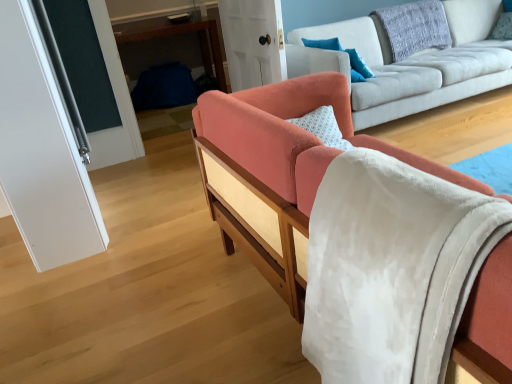
What do you see at coordinates (346, 52) in the screenshot? I see `blue textured pillow at upper center, which is counted as the 1th pillow, starting from the left` at bounding box center [346, 52].

Locate an element on the screen. blue textured pillow at upper center, marked as the 3th pillow in a right-to-left arrangement is located at coordinates (346, 52).

Locate an element on the screen. This screenshot has width=512, height=384. textured gray pillow at upper right, the second pillow positioned from the left is located at coordinates (414, 27).

The width and height of the screenshot is (512, 384). What are the coordinates of `coral fabric couch at center, the 1th studio couch when ordered from front to back` in the screenshot? It's located at (280, 171).

Identify the location of blue textured pillow at upper center, marked as the 3th pillow in a right-to-left arrangement. click(346, 52).

Is coral fabric couch at center, which ranks as the 2th studio couch in back-to-front order, taller than light gray fabric couch at center, the second studio couch from the front?

Yes, coral fabric couch at center, which ranks as the 2th studio couch in back-to-front order, is taller than light gray fabric couch at center, the second studio couch from the front.

In terms of width, does coral fabric couch at center, which ranks as the 2th studio couch in back-to-front order, look wider or thinner when compared to light gray fabric couch at center, the second studio couch from the front?

In the image, coral fabric couch at center, which ranks as the 2th studio couch in back-to-front order, appears to be more narrow than light gray fabric couch at center, the second studio couch from the front.

Where is `studio couch below the light gray fabric couch at center, the second studio couch from the front (from the image's perspective)`? This screenshot has width=512, height=384. studio couch below the light gray fabric couch at center, the second studio couch from the front (from the image's perspective) is located at coordinates (280, 171).

Does coral fabric couch at center, the 1th studio couch when ordered from front to back, turn towards light gray fabric couch at center, the second studio couch from the front?

Yes, coral fabric couch at center, the 1th studio couch when ordered from front to back, faces towards light gray fabric couch at center, the second studio couch from the front.

Considering the relative sizes of textured gray pillow at upper right, the second pillow positioned from the left, and blue fabric table at center in the image provided, is textured gray pillow at upper right, the second pillow positioned from the left, shorter than blue fabric table at center?

Indeed, textured gray pillow at upper right, the second pillow positioned from the left, has a lesser height compared to blue fabric table at center.

At what (x,y) coordinates should I click in order to perform the action: click on table above the textured gray pillow at upper right, which appears as the second pillow when viewed from the right (from the image's perspective). Please return your answer as a coordinate pair (x, y). Looking at the image, I should click on (170, 46).

Which object is positioned more to the right, textured gray pillow at upper right, which appears as the second pillow when viewed from the right, or blue fabric table at center?

From the viewer's perspective, textured gray pillow at upper right, which appears as the second pillow when viewed from the right, appears more on the right side.

Can you tell me how much blue textured pillow at upper right, the first pillow when ordered from right to left, and transparent glass door at upper center, the first glass door from the right, differ in facing direction?

blue textured pillow at upper right, the first pillow when ordered from right to left, and transparent glass door at upper center, the first glass door from the right, are facing 26.1 degrees away from each other.

Considering the positions of objects blue textured pillow at upper right, the first pillow when ordered from right to left, and transparent glass door at upper center, arranged as the second glass door when viewed from the left, in the image provided, who is behind, blue textured pillow at upper right, the first pillow when ordered from right to left, or transparent glass door at upper center, arranged as the second glass door when viewed from the left,?

blue textured pillow at upper right, the first pillow when ordered from right to left, is further away from the camera.

Is transparent glass door at upper center, which is the 2th glass door from front to back, located within blue textured pillow at upper right, the first pillow when ordered from right to left?

No, transparent glass door at upper center, which is the 2th glass door from front to back, is not a part of blue textured pillow at upper right, the first pillow when ordered from right to left.

Between coral fabric couch at center, which ranks as the 2th studio couch in back-to-front order, and clear glass door at upper left, the second glass door in the right-to-left sequence, which one is positioned behind?

clear glass door at upper left, the second glass door in the right-to-left sequence, is further away from the camera.

Is coral fabric couch at center, which ranks as the 2th studio couch in back-to-front order, wider or thinner than clear glass door at upper left, placed as the first glass door when sorted from front to back?

In the image, coral fabric couch at center, which ranks as the 2th studio couch in back-to-front order, appears to be wider than clear glass door at upper left, placed as the first glass door when sorted from front to back.

Which is farther, (279, 279) or (56, 2)?

Positioned behind is point (56, 2).

Is coral fabric couch at center, which ranks as the 2th studio couch in back-to-front order, positioned with its back to clear glass door at upper left, the second glass door in the right-to-left sequence?

coral fabric couch at center, which ranks as the 2th studio couch in back-to-front order, does not have its back to clear glass door at upper left, the second glass door in the right-to-left sequence.

How different are the orientations of blue fabric table at center and transparent glass door at upper center, arranged as the second glass door when viewed from the left, in degrees?

The angular difference between blue fabric table at center and transparent glass door at upper center, arranged as the second glass door when viewed from the left, is 99 degrees.

From the image's perspective, is blue fabric table at center above or below transparent glass door at upper center, which is the 2th glass door from front to back?

Clearly, from the image's perspective, blue fabric table at center is above transparent glass door at upper center, which is the 2th glass door from front to back.

Measure the distance from blue fabric table at center to transparent glass door at upper center, arranged as the second glass door when viewed from the left.

5.40 feet.

Considering the sizes of blue fabric table at center and transparent glass door at upper center, which is the 2th glass door from front to back, in the image, is blue fabric table at center bigger or smaller than transparent glass door at upper center, which is the 2th glass door from front to back,?

In the image, blue fabric table at center appears to be larger than transparent glass door at upper center, which is the 2th glass door from front to back.

What's the angular difference between textured gray pillow at upper right, which appears as the second pillow when viewed from the right, and light gray fabric couch at center, the second studio couch from the front,'s facing directions?

The angle between the facing direction of textured gray pillow at upper right, which appears as the second pillow when viewed from the right, and the facing direction of light gray fabric couch at center, the second studio couch from the front, is 0.000285 degrees.

Is textured gray pillow at upper right, which appears as the second pillow when viewed from the right, inside or outside of light gray fabric couch at center, the second studio couch from the front?

textured gray pillow at upper right, which appears as the second pillow when viewed from the right, is spatially positioned inside light gray fabric couch at center, the second studio couch from the front.

Is textured gray pillow at upper right, which appears as the second pillow when viewed from the right, to the left of light gray fabric couch at center, the first studio couch positioned from the back, from the viewer's perspective?

Correct, you'll find textured gray pillow at upper right, which appears as the second pillow when viewed from the right, to the left of light gray fabric couch at center, the first studio couch positioned from the back.

From the image's perspective, is textured gray pillow at upper right, which appears as the second pillow when viewed from the right, beneath light gray fabric couch at center, the first studio couch positioned from the back?

Incorrect, from the image's perspective, textured gray pillow at upper right, which appears as the second pillow when viewed from the right, is higher than light gray fabric couch at center, the first studio couch positioned from the back.

Does coral fabric couch at center, which ranks as the 2th studio couch in back-to-front order, turn towards blue textured pillow at upper center, which is counted as the 1th pillow, starting from the left?

No, coral fabric couch at center, which ranks as the 2th studio couch in back-to-front order, is not aimed at blue textured pillow at upper center, which is counted as the 1th pillow, starting from the left.

Is there a large distance between coral fabric couch at center, the 1th studio couch when ordered from front to back, and blue textured pillow at upper center, marked as the 3th pillow in a right-to-left arrangement?

Yes, coral fabric couch at center, the 1th studio couch when ordered from front to back, is far from blue textured pillow at upper center, marked as the 3th pillow in a right-to-left arrangement.

In the image, is coral fabric couch at center, the 1th studio couch when ordered from front to back, positioned in front of or behind blue textured pillow at upper center, marked as the 3th pillow in a right-to-left arrangement?

coral fabric couch at center, the 1th studio couch when ordered from front to back, is in front of blue textured pillow at upper center, marked as the 3th pillow in a right-to-left arrangement.

Which is in front, point (483, 296) or point (359, 74)?

Positioned in front is point (483, 296).

This screenshot has width=512, height=384. In order to click on studio couch behind the coral fabric couch at center, which ranks as the 2th studio couch in back-to-front order in this screenshot , I will do `click(411, 63)`.

The height and width of the screenshot is (384, 512). Identify the location of table above the textured gray pillow at upper right, which appears as the second pillow when viewed from the right (from the image's perspective). (170, 46).

Which object lies further to the anchor point transparent glass door at upper center, arranged as the second glass door when viewed from the left, textured gray pillow at upper right, which appears as the second pillow when viewed from the right, or blue textured pillow at upper right, the first pillow when ordered from right to left?

blue textured pillow at upper right, the first pillow when ordered from right to left, is further to transparent glass door at upper center, arranged as the second glass door when viewed from the left.

From the image, which object appears to be nearer to light gray fabric couch at center, the second studio couch from the front, clear glass door at upper left, the second glass door in the right-to-left sequence, or coral fabric couch at center, which ranks as the 2th studio couch in back-to-front order?

coral fabric couch at center, which ranks as the 2th studio couch in back-to-front order, is positioned closer to the anchor light gray fabric couch at center, the second studio couch from the front.

Looking at the image, which one is located further to light gray fabric couch at center, the first studio couch positioned from the back, blue textured pillow at upper right, the first pillow when ordered from right to left, or coral fabric couch at center, which ranks as the 2th studio couch in back-to-front order?

coral fabric couch at center, which ranks as the 2th studio couch in back-to-front order, lies further to light gray fabric couch at center, the first studio couch positioned from the back, than the other object.

Estimate the real-world distances between objects in this image. Which object is closer to clear glass door at upper left, acting as the 2th glass door starting from the back, blue textured pillow at upper right, placed as the third pillow when sorted from left to right, or blue textured pillow at upper center, marked as the 3th pillow in a right-to-left arrangement?

Based on the image, blue textured pillow at upper center, marked as the 3th pillow in a right-to-left arrangement, appears to be nearer to clear glass door at upper left, acting as the 2th glass door starting from the back.

Which object lies further to the anchor point blue fabric table at center, coral fabric couch at center, the 1th studio couch when ordered from front to back, or light gray fabric couch at center, the first studio couch positioned from the back?

Among the two, coral fabric couch at center, the 1th studio couch when ordered from front to back, is located further to blue fabric table at center.

Based on the photo, estimate the real-world distances between objects in this image. Which object is closer to blue textured pillow at upper right, placed as the third pillow when sorted from left to right, clear glass door at upper left, the second glass door in the right-to-left sequence, or blue fabric table at center?

blue fabric table at center lies closer to blue textured pillow at upper right, placed as the third pillow when sorted from left to right, than the other object.

Looking at the image, which one is located closer to blue textured pillow at upper right, placed as the third pillow when sorted from left to right, blue fabric table at center or textured gray pillow at upper right, the second pillow positioned from the left?

The object closer to blue textured pillow at upper right, placed as the third pillow when sorted from left to right, is textured gray pillow at upper right, the second pillow positioned from the left.

Which object lies nearer to the anchor point blue textured pillow at upper right, the first pillow when ordered from right to left, blue fabric table at center or blue textured pillow at upper center, marked as the 3th pillow in a right-to-left arrangement?

The object closer to blue textured pillow at upper right, the first pillow when ordered from right to left, is blue textured pillow at upper center, marked as the 3th pillow in a right-to-left arrangement.

Locate an element on the screen. studio couch between coral fabric couch at center, which ranks as the 2th studio couch in back-to-front order, and textured gray pillow at upper right, the second pillow positioned from the left, in the front-back direction is located at coordinates (411, 63).

Locate an element on the screen. studio couch located between coral fabric couch at center, which ranks as the 2th studio couch in back-to-front order, and blue fabric table at center in the depth direction is located at coordinates (411, 63).

Where is `glass door between coral fabric couch at center, which ranks as the 2th studio couch in back-to-front order, and transparent glass door at upper center, arranged as the second glass door when viewed from the left, in the front-back direction`? This screenshot has width=512, height=384. glass door between coral fabric couch at center, which ranks as the 2th studio couch in back-to-front order, and transparent glass door at upper center, arranged as the second glass door when viewed from the left, in the front-back direction is located at coordinates (92, 78).

At what (x,y) coordinates should I click in order to perform the action: click on glass door situated between clear glass door at upper left, the second glass door in the right-to-left sequence, and blue textured pillow at upper center, marked as the 3th pillow in a right-to-left arrangement, from left to right. Please return your answer as a coordinate pair (x, y). Looking at the image, I should click on (253, 42).